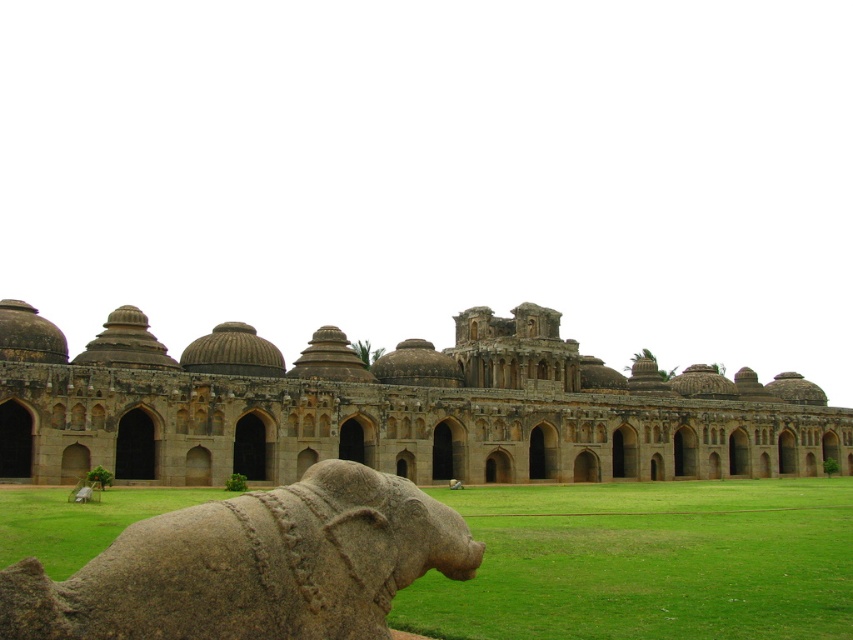
Between brown stone palace at center and gray stone elephant at lower left, which one has less height?

Standing shorter between the two is gray stone elephant at lower left.

At what (x,y) coordinates should I click in order to perform the action: click on brown stone palace at center. Please return your answer as a coordinate pair (x, y). The width and height of the screenshot is (853, 640). Looking at the image, I should click on (392, 408).

Locate an element on the screen. brown stone palace at center is located at coordinates (392, 408).